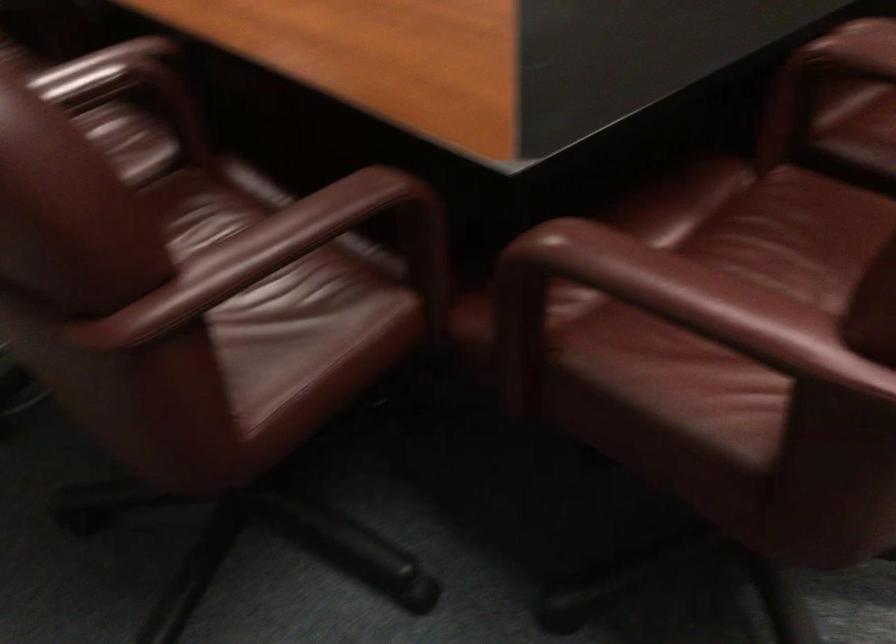
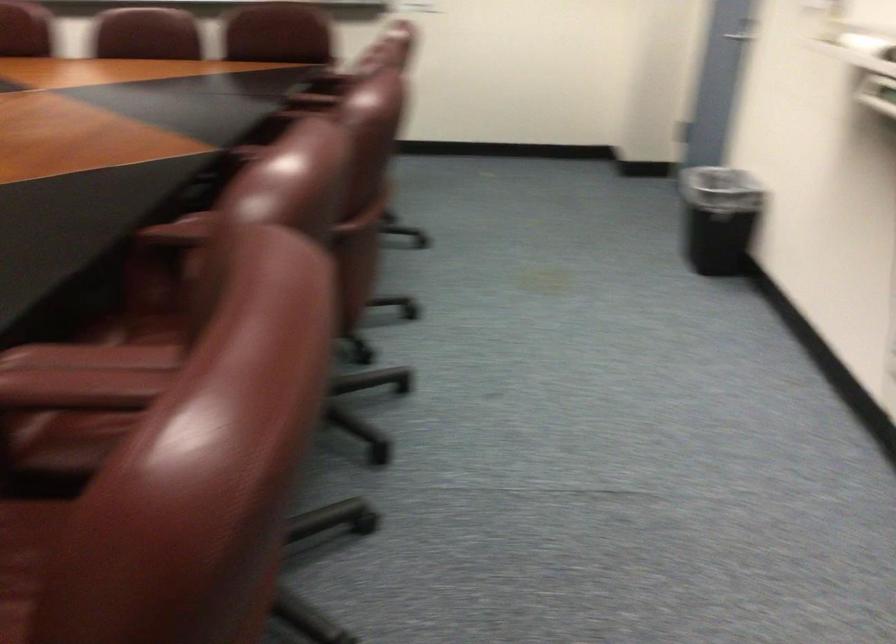
Question: Which direction would the cameraman need to move to produce the second image? Reply with the corresponding letter.

Choices:
 (A) Left
 (B) Right
 (C) Forward
 (D) Backward

Answer: (D)